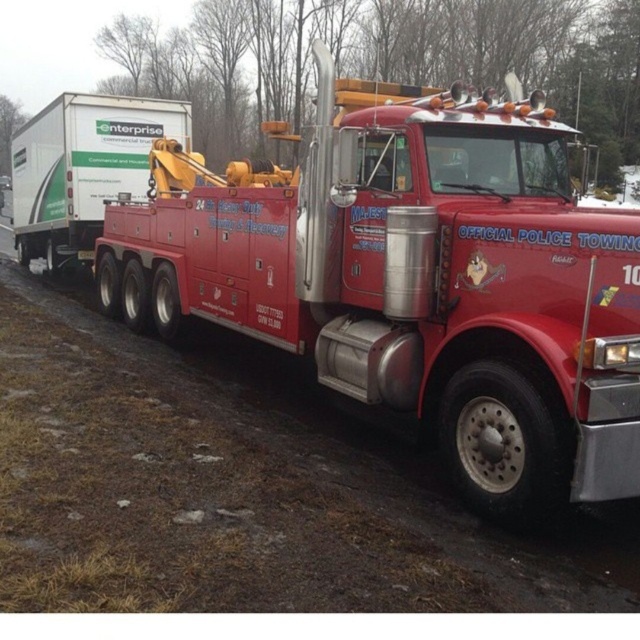
You are standing on the roadside and want to take a photo of the shiny red tow truck at center. If your camera can focus on objects up to 4 meters away, will it be able to capture the truck clearly?

The shiny red tow truck at center is 3.54 meters away from the viewer, so yes, the camera can focus on it since it is within the 4 meters range.

Consider the image. You are a delivery driver who needs to park your car near the shiny red tow truck at center. The parking spot you want is at coordinate point 0.439, 0.647. Can you park your car there?

The shiny red tow truck at center is already located at point (413, 280), so you cannot park your car there.

From the picture: You are a driver trying to park your car behind the shiny red tow truck at center and the white matte trailer at left. Which one will block your view more when you are reversing?

The shiny red tow truck at center is much taller than the white matte trailer at left, so it will block your view more when reversing.